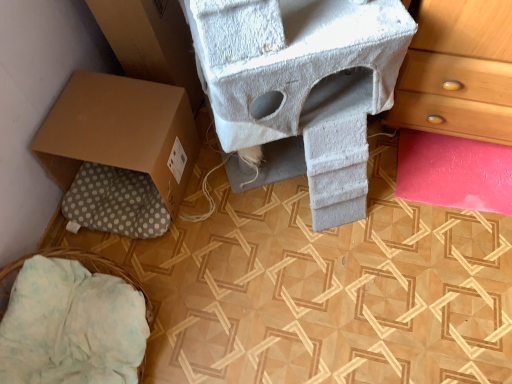
Question: Can you confirm if white fabric basket at lower left is taller than brown cardboard box at left?

Choices:
 (A) yes
 (B) no

Answer: (B)

Question: Does white fabric basket at lower left have a lesser width compared to brown cardboard box at left?

Choices:
 (A) no
 (B) yes

Answer: (A)

Question: Is white fabric basket at lower left next to brown cardboard box at left and touching it?

Choices:
 (A) yes
 (B) no

Answer: (B)

Question: From a real-world perspective, is white fabric basket at lower left located higher than brown cardboard box at left?

Choices:
 (A) no
 (B) yes

Answer: (A)

Question: Can you confirm if white fabric basket at lower left is bigger than brown cardboard box at left?

Choices:
 (A) yes
 (B) no

Answer: (B)

Question: Considering the positions of white fabric basket at lower left and brown cardboard box at lower left in the image, is white fabric basket at lower left bigger or smaller than brown cardboard box at lower left?

Choices:
 (A) big
 (B) small

Answer: (B)

Question: Relative to brown cardboard box at lower left, is white fabric basket at lower left in front or behind?

Choices:
 (A) front
 (B) behind

Answer: (A)

Question: Considering the positions of white fabric basket at lower left and brown cardboard box at lower left in the image, is white fabric basket at lower left wider or thinner than brown cardboard box at lower left?

Choices:
 (A) wide
 (B) thin

Answer: (A)

Question: From their relative heights in the image, would you say white fabric basket at lower left is taller or shorter than brown cardboard box at lower left?

Choices:
 (A) tall
 (B) short

Answer: (B)

Question: Would you say brown cardboard box at lower left is to the left or to the right of white fabric basket at lower left in the picture?

Choices:
 (A) right
 (B) left

Answer: (A)

Question: Is brown cardboard box at lower left inside the boundaries of white fabric basket at lower left, or outside?

Choices:
 (A) inside
 (B) outside

Answer: (B)

Question: From a real-world perspective, relative to white fabric basket at lower left, is brown cardboard box at lower left vertically above or below?

Choices:
 (A) above
 (B) below

Answer: (A)

Question: Is brown cardboard box at lower left bigger or smaller than white fabric basket at lower left?

Choices:
 (A) small
 (B) big

Answer: (B)

Question: Considering their positions, is brown cardboard box at left located in front of or behind white fabric basket at lower left?

Choices:
 (A) front
 (B) behind

Answer: (B)

Question: Do you think brown cardboard box at left is within white fabric basket at lower left, or outside of it?

Choices:
 (A) outside
 (B) inside

Answer: (A)